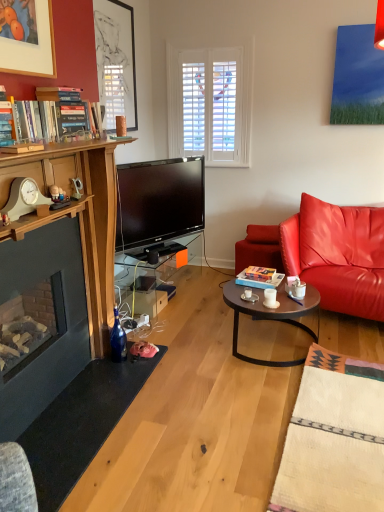
Question: Should I look upward or downward to see wooden round table at center?

Choices:
 (A) down
 (B) up

Answer: (A)

Question: Is white ceramic mug at center not inside hardcover books at left, which is the first book from front to back?

Choices:
 (A) no
 (B) yes

Answer: (B)

Question: Is white ceramic mug at center positioned behind hardcover books at left, the second book in the bottom-to-top sequence?

Choices:
 (A) yes
 (B) no

Answer: (A)

Question: Is white ceramic mug at center at the right side of hardcover books at left, which is the first book from front to back?

Choices:
 (A) no
 (B) yes

Answer: (B)

Question: Is white ceramic mug at center to the left of hardcover books at left, acting as the 1th book starting from the top, from the viewer's perspective?

Choices:
 (A) yes
 (B) no

Answer: (B)

Question: Is white ceramic mug at center directly adjacent to hardcover books at left, acting as the 1th book starting from the top?

Choices:
 (A) no
 (B) yes

Answer: (A)

Question: Considering the relative sizes of white ceramic mug at center and hardcover books at left, which appears as the first book when viewed from the left, in the image provided, is white ceramic mug at center smaller than hardcover books at left, which appears as the first book when viewed from the left,?

Choices:
 (A) yes
 (B) no

Answer: (A)

Question: Is there a large distance between blue glass bottle at lower left and hardcover book at center, the 1th book in the back-to-front sequence?

Choices:
 (A) yes
 (B) no

Answer: (B)

Question: From a real-world perspective, is blue glass bottle at lower left on top of hardcover book at center, acting as the first book starting from the right?

Choices:
 (A) yes
 (B) no

Answer: (B)

Question: Does blue glass bottle at lower left have a lesser height compared to hardcover book at center, which is the 2th book from front to back?

Choices:
 (A) yes
 (B) no

Answer: (B)

Question: Can you confirm if blue glass bottle at lower left is positioned to the right of hardcover book at center, the first book when ordered from bottom to top?

Choices:
 (A) no
 (B) yes

Answer: (A)

Question: From the image's perspective, would you say blue glass bottle at lower left is shown under hardcover book at center, the 1th book in the back-to-front sequence?

Choices:
 (A) no
 (B) yes

Answer: (B)

Question: Does blue glass bottle at lower left turn towards hardcover book at center, acting as the first book starting from the right?

Choices:
 (A) no
 (B) yes

Answer: (A)

Question: Does transparent glass table at center have a lesser height compared to hardcover book at center, marked as the 2th book in a top-to-bottom arrangement?

Choices:
 (A) yes
 (B) no

Answer: (B)